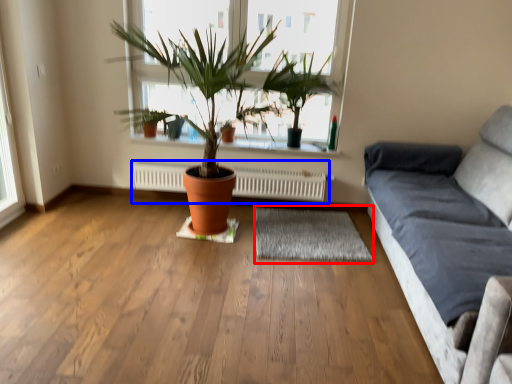
Question: Which point is closer to the camera, mat (highlighted by a red box) or heater (highlighted by a blue box)?

Choices:
 (A) mat
 (B) heater

Answer: (A)